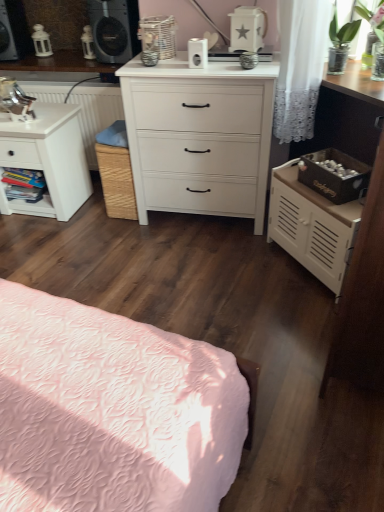
What is the approximate width of white matte cabinet at right, placed as the second nightstand when sorted from left to right?

The width of white matte cabinet at right, placed as the second nightstand when sorted from left to right, is 12.97 inches.

What do you see at coordinates (47, 159) in the screenshot? I see `white matte nightstand at left, the 1th nightstand in the left-to-right sequence` at bounding box center [47, 159].

In order to face matte black speaker at upper left, which is the 2th speaker from right to left, should I rotate leftwards or rightwards?

A 24.008 degree turn to the left will do.

In order to face white matte chest of drawers at center, should I rotate leftwards or rightwards?

Rotate right and turn 1.644 degrees.

This screenshot has width=384, height=512. In order to click on white matte chest of drawers at center in this screenshot , I will do `click(199, 137)`.

The height and width of the screenshot is (512, 384). In order to click on white matte cabinet at right, the first nightstand in the right-to-left sequence in this screenshot , I will do `click(312, 226)`.

Considering the sizes of objects white matte cabinet at right, placed as the second nightstand when sorted from left to right, and matte black speaker at upper left, which is the 2th speaker from right to left, in the image provided, who is wider, white matte cabinet at right, placed as the second nightstand when sorted from left to right, or matte black speaker at upper left, which is the 2th speaker from right to left,?

With larger width is matte black speaker at upper left, which is the 2th speaker from right to left.

From the image's perspective, starting from the matte black speaker at upper left, which is the 2th speaker from right to left, which nightstand is the 2nd one below? Please provide its 2D coordinates.

[(312, 226)]

Based on their sizes in the image, would you say white matte cabinet at right, placed as the second nightstand when sorted from left to right, is bigger or smaller than matte black speaker at upper left, the 1th speaker from the left?

Clearly, white matte cabinet at right, placed as the second nightstand when sorted from left to right, is larger in size than matte black speaker at upper left, the 1th speaker from the left.

Could you tell me if white matte chest of drawers at center is facing matte black speaker at upper left, which is the 2th speaker from right to left?

No, white matte chest of drawers at center is not facing towards matte black speaker at upper left, which is the 2th speaker from right to left.

Does point (202, 190) appear closer or farther from the camera than point (25, 36)?

Clearly, point (202, 190) is closer to the camera than point (25, 36).

Is white matte chest of drawers at center closer to the viewer compared to matte black speaker at upper left, which is the 2th speaker from right to left?

Yes, it is.

How many degrees apart are the facing directions of white matte chest of drawers at center and matte black speaker at upper left, the 1th speaker from the left?

8.41 degrees separate the facing orientations of white matte chest of drawers at center and matte black speaker at upper left, the 1th speaker from the left.

From the image's perspective, is matte black speaker at upper left, which is the 2th speaker from right to left, above or below matte black speaker at upper center, marked as the first speaker in a right-to-left arrangement?

matte black speaker at upper left, which is the 2th speaker from right to left, is above matte black speaker at upper center, marked as the first speaker in a right-to-left arrangement.

Considering the positions of objects matte black speaker at upper left, the 1th speaker from the left, and matte black speaker at upper center, which is counted as the 2th speaker, starting from the left, in the image provided, who is more to the left, matte black speaker at upper left, the 1th speaker from the left, or matte black speaker at upper center, which is counted as the 2th speaker, starting from the left,?

From the viewer's perspective, matte black speaker at upper left, the 1th speaker from the left, appears more on the left side.

Is matte black speaker at upper left, which is the 2th speaker from right to left, in contact with matte black speaker at upper center, which is counted as the 2th speaker, starting from the left?

matte black speaker at upper left, which is the 2th speaker from right to left, and matte black speaker at upper center, which is counted as the 2th speaker, starting from the left, are not in contact.

How different are the orientations of matte black speaker at upper left, which is the 2th speaker from right to left, and matte black speaker at upper center, marked as the first speaker in a right-to-left arrangement, in degrees?

18.5 degrees.

Where is `speaker lying on the right of wooden bookshelf at left`? Image resolution: width=384 pixels, height=512 pixels. speaker lying on the right of wooden bookshelf at left is located at coordinates (114, 29).

Is matte black speaker at upper center, marked as the first speaker in a right-to-left arrangement, not within wooden bookshelf at left?

matte black speaker at upper center, marked as the first speaker in a right-to-left arrangement, lies outside wooden bookshelf at left's area.

Is matte black speaker at upper center, marked as the first speaker in a right-to-left arrangement, oriented away from wooden bookshelf at left?

matte black speaker at upper center, marked as the first speaker in a right-to-left arrangement, is not turned away from wooden bookshelf at left.

In terms of size, does matte black speaker at upper center, marked as the first speaker in a right-to-left arrangement, appear bigger or smaller than wooden bookshelf at left?

In the image, matte black speaker at upper center, marked as the first speaker in a right-to-left arrangement, appears to be larger than wooden bookshelf at left.

How many degrees apart are the facing directions of matte black speaker at upper center, which is counted as the 2th speaker, starting from the left, and white matte chest of drawers at center?

10.1 degrees separate the facing orientations of matte black speaker at upper center, which is counted as the 2th speaker, starting from the left, and white matte chest of drawers at center.

From the image's perspective, which one is positioned lower, matte black speaker at upper center, marked as the first speaker in a right-to-left arrangement, or white matte chest of drawers at center?

white matte chest of drawers at center is shown below in the image.

Which of these two, matte black speaker at upper center, marked as the first speaker in a right-to-left arrangement, or white matte chest of drawers at center, stands shorter?

Standing shorter between the two is matte black speaker at upper center, marked as the first speaker in a right-to-left arrangement.

Between matte black speaker at upper center, marked as the first speaker in a right-to-left arrangement, and white matte chest of drawers at center, which one has larger size?

white matte chest of drawers at center is bigger.

Is white matte chest of drawers at center outside of matte black speaker at upper center, which is counted as the 2th speaker, starting from the left?

That's correct, white matte chest of drawers at center is outside of matte black speaker at upper center, which is counted as the 2th speaker, starting from the left.

Is white matte chest of drawers at center touching matte black speaker at upper center, which is counted as the 2th speaker, starting from the left?

white matte chest of drawers at center and matte black speaker at upper center, which is counted as the 2th speaker, starting from the left, are not in contact.

From a real-world perspective, between white matte chest of drawers at center and matte black speaker at upper center, which is counted as the 2th speaker, starting from the left, who is vertically higher?

matte black speaker at upper center, which is counted as the 2th speaker, starting from the left, from a real-world perspective.

Consider the image. Can you tell me how much white matte chest of drawers at center and matte black speaker at upper center, which is counted as the 2th speaker, starting from the left, differ in facing direction?

The angle between the facing direction of white matte chest of drawers at center and the facing direction of matte black speaker at upper center, which is counted as the 2th speaker, starting from the left, is 10.1 degrees.

Considering their positions, is matte black speaker at upper center, which is counted as the 2th speaker, starting from the left, located in front of or behind white matte nightstand at left, the 2th nightstand positioned from the right?

Visually, matte black speaker at upper center, which is counted as the 2th speaker, starting from the left, is located behind white matte nightstand at left, the 2th nightstand positioned from the right.

Considering the sizes of objects matte black speaker at upper center, marked as the first speaker in a right-to-left arrangement, and white matte nightstand at left, the 2th nightstand positioned from the right, in the image provided, who is wider, matte black speaker at upper center, marked as the first speaker in a right-to-left arrangement, or white matte nightstand at left, the 2th nightstand positioned from the right,?

white matte nightstand at left, the 2th nightstand positioned from the right.

Would you say matte black speaker at upper center, marked as the first speaker in a right-to-left arrangement, is outside white matte nightstand at left, the 2th nightstand positioned from the right?

Indeed, matte black speaker at upper center, marked as the first speaker in a right-to-left arrangement, is completely outside white matte nightstand at left, the 2th nightstand positioned from the right.

You are a GUI agent. You are given a task and a screenshot of the screen. Output one action in this format:
    pyautogui.click(x=<x>, y=<y>)
    Task: Click on the 2nd nightstand to the right when counting from the matte black speaker at upper left, the 1th speaker from the left
    This screenshot has height=512, width=384.
    Given the screenshot: What is the action you would take?
    pyautogui.click(x=312, y=226)

Where is `chest of drawers in front of the matte black speaker at upper left, which is the 2th speaker from right to left`? This screenshot has height=512, width=384. chest of drawers in front of the matte black speaker at upper left, which is the 2th speaker from right to left is located at coordinates (199, 137).

Based on their spatial positions, is wooden bookshelf at left or matte black speaker at upper center, which is counted as the 2th speaker, starting from the left, further from white matte nightstand at left, the 1th nightstand in the left-to-right sequence?

matte black speaker at upper center, which is counted as the 2th speaker, starting from the left, is further to white matte nightstand at left, the 1th nightstand in the left-to-right sequence.

When comparing their distances from wooden bookshelf at left, does white matte chest of drawers at center or matte black speaker at upper center, marked as the first speaker in a right-to-left arrangement, seem further?

Among the two, white matte chest of drawers at center is located further to wooden bookshelf at left.

From the image, which object appears to be nearer to matte black speaker at upper left, which is the 2th speaker from right to left, matte black speaker at upper center, marked as the first speaker in a right-to-left arrangement, or wooden bookshelf at left?

matte black speaker at upper center, marked as the first speaker in a right-to-left arrangement, is positioned closer to the anchor matte black speaker at upper left, which is the 2th speaker from right to left.

Which object lies further to the anchor point matte black speaker at upper center, marked as the first speaker in a right-to-left arrangement, white matte chest of drawers at center or white matte nightstand at left, the 1th nightstand in the left-to-right sequence?

The object further to matte black speaker at upper center, marked as the first speaker in a right-to-left arrangement, is white matte chest of drawers at center.

Estimate the real-world distances between objects in this image. Which object is closer to white matte nightstand at left, the 1th nightstand in the left-to-right sequence, white matte chest of drawers at center or white matte cabinet at right, placed as the second nightstand when sorted from left to right?

white matte chest of drawers at center is positioned closer to the anchor white matte nightstand at left, the 1th nightstand in the left-to-right sequence.

Considering their positions, is matte black speaker at upper center, which is counted as the 2th speaker, starting from the left, positioned further to white matte cabinet at right, the first nightstand in the right-to-left sequence, than matte black speaker at upper left, the 1th speaker from the left?

matte black speaker at upper left, the 1th speaker from the left, is further to white matte cabinet at right, the first nightstand in the right-to-left sequence.

When comparing their distances from matte black speaker at upper center, marked as the first speaker in a right-to-left arrangement, does white matte cabinet at right, placed as the second nightstand when sorted from left to right, or white matte chest of drawers at center seem closer?

white matte chest of drawers at center is closer to matte black speaker at upper center, marked as the first speaker in a right-to-left arrangement.

Looking at the image, which one is located further to white matte chest of drawers at center, matte black speaker at upper center, marked as the first speaker in a right-to-left arrangement, or matte black speaker at upper left, the 1th speaker from the left?

Based on the image, matte black speaker at upper left, the 1th speaker from the left, appears to be further to white matte chest of drawers at center.

At what (x,y) coordinates should I click in order to perform the action: click on the chest of drawers located between matte black speaker at upper left, the 1th speaker from the left, and white matte cabinet at right, the first nightstand in the right-to-left sequence, in the left-right direction. Please return your answer as a coordinate pair (x, y). The width and height of the screenshot is (384, 512). Looking at the image, I should click on (199, 137).

The height and width of the screenshot is (512, 384). Find the location of `nightstand between matte black speaker at upper left, the 1th speaker from the left, and wooden bookshelf at left in the up-down direction`. nightstand between matte black speaker at upper left, the 1th speaker from the left, and wooden bookshelf at left in the up-down direction is located at coordinates (47, 159).

You are a GUI agent. You are given a task and a screenshot of the screen. Output one action in this format:
    pyautogui.click(x=<x>, y=<y>)
    Task: Click on the speaker between matte black speaker at upper left, the 1th speaker from the left, and white matte cabinet at right, placed as the second nightstand when sorted from left to right, from left to right
    The image size is (384, 512).
    Given the screenshot: What is the action you would take?
    pyautogui.click(x=114, y=29)

This screenshot has height=512, width=384. In order to click on chest of drawers between matte black speaker at upper center, marked as the first speaker in a right-to-left arrangement, and white matte cabinet at right, placed as the second nightstand when sorted from left to right, from top to bottom in this screenshot , I will do `click(199, 137)`.